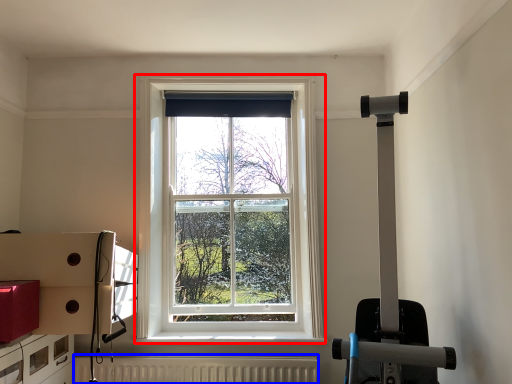
Question: Which object appears closest to the camera in this image, window (highlighted by a red box) or radiator (highlighted by a blue box)?

Choices:
 (A) window
 (B) radiator

Answer: (B)